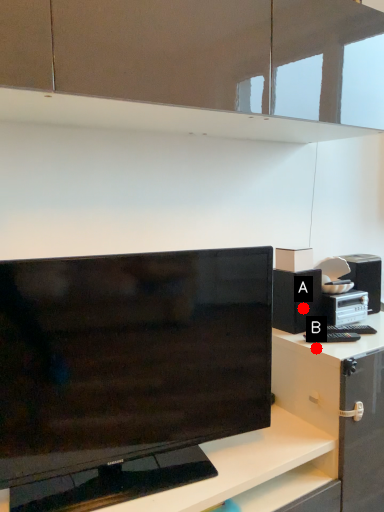
Question: Two points are circled on the image, labeled by A and B beside each circle. Which point is farther to the camera?

Choices:
 (A) A is further
 (B) B is further

Answer: (A)